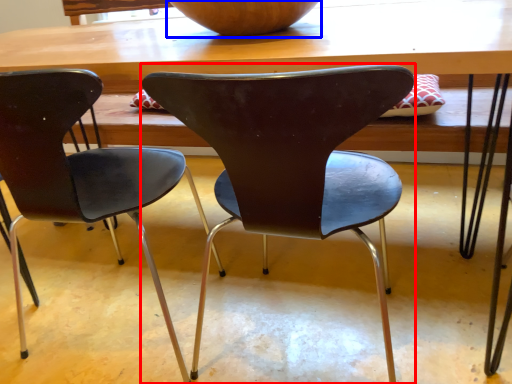
Question: Which point is further to the camera, chair (highlighted by a red box) or bowl (highlighted by a blue box)?

Choices:
 (A) chair
 (B) bowl

Answer: (B)